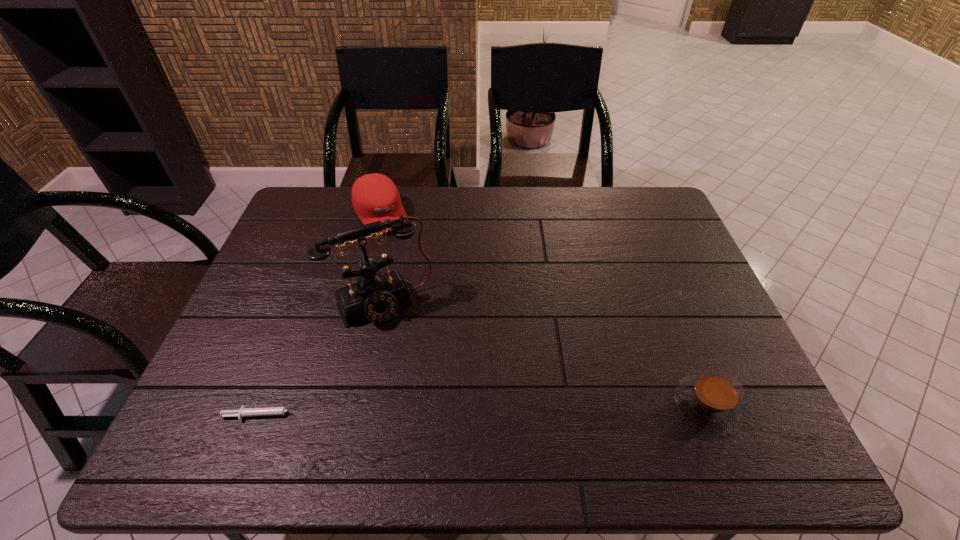
Where is `the shortest object`? This screenshot has height=540, width=960. the shortest object is located at coordinates (271, 411).

Identify the location of cappuccino. (712, 400).

The image size is (960, 540). Identify the location of the rightmost object. pos(712,400).

Where is `the tallest object`? the tallest object is located at coordinates (375, 296).

Locate an element on the screen. The height and width of the screenshot is (540, 960). telephone is located at coordinates (375, 296).

This screenshot has width=960, height=540. I want to click on the farthest object, so click(x=375, y=197).

The width and height of the screenshot is (960, 540). Find the location of `cap`. cap is located at coordinates (375, 197).

The height and width of the screenshot is (540, 960). In order to click on free location located 0.060m on the left of the syringe in this screenshot , I will do `click(197, 415)`.

Where is `vacant space positioned 0.220m on the back of the cappuccino`? vacant space positioned 0.220m on the back of the cappuccino is located at coordinates (666, 306).

The height and width of the screenshot is (540, 960). I want to click on vacant region located 0.110m on the dial of the telephone, so click(x=417, y=357).